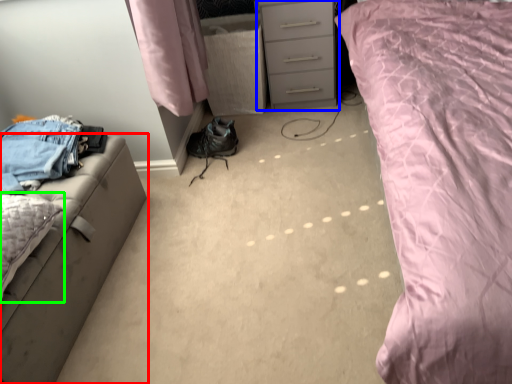
Question: Which is farther away from furniture (highlighted by a red box)? chest of drawers (highlighted by a blue box) or pillow (highlighted by a green box)?

Choices:
 (A) chest of drawers
 (B) pillow

Answer: (A)